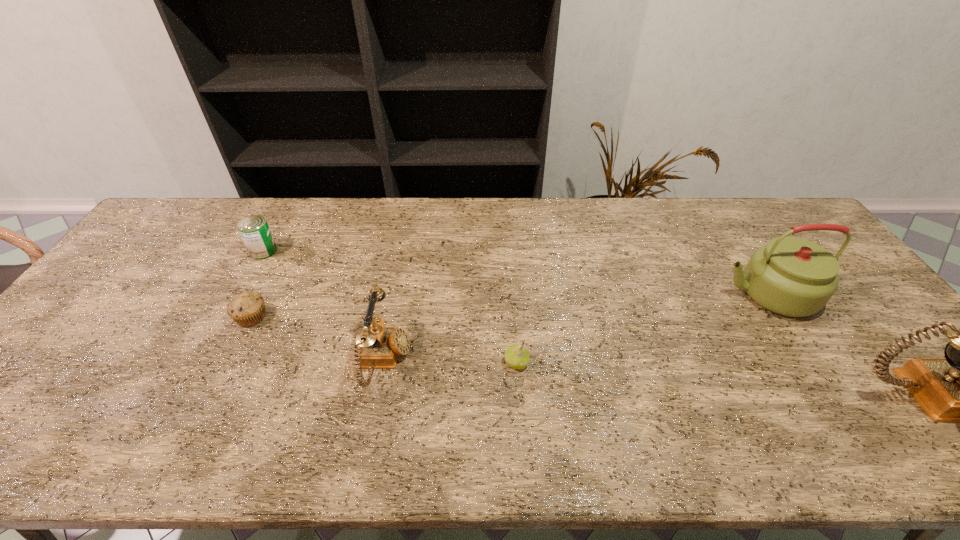
Image resolution: width=960 pixels, height=540 pixels. What are the coordinates of `the left telephone` in the screenshot? It's located at (380, 346).

Locate an element on the screen. This screenshot has width=960, height=540. the shorter telephone is located at coordinates (380, 346).

Find the location of a particular element. the farthest object is located at coordinates (254, 230).

The height and width of the screenshot is (540, 960). In order to click on the shortest object in this screenshot , I will do `click(247, 309)`.

Locate an element on the screen. This screenshot has height=540, width=960. pear is located at coordinates (516, 356).

The height and width of the screenshot is (540, 960). I want to click on kettle, so click(x=791, y=276).

Locate an element on the screen. Image resolution: width=960 pixels, height=540 pixels. vacant position located on the dial number of the left telephone is located at coordinates (478, 361).

Locate an element on the screen. Image resolution: width=960 pixels, height=540 pixels. vacant area located on the front of the farthest object is located at coordinates (229, 313).

At what (x,y) coordinates should I click in order to perform the action: click on vacant area situated 0.140m on the back of the muffin. Please return your answer as a coordinate pair (x, y). Looking at the image, I should click on (275, 269).

Where is `blank space located 0.090m on the right of the pear`? blank space located 0.090m on the right of the pear is located at coordinates (565, 363).